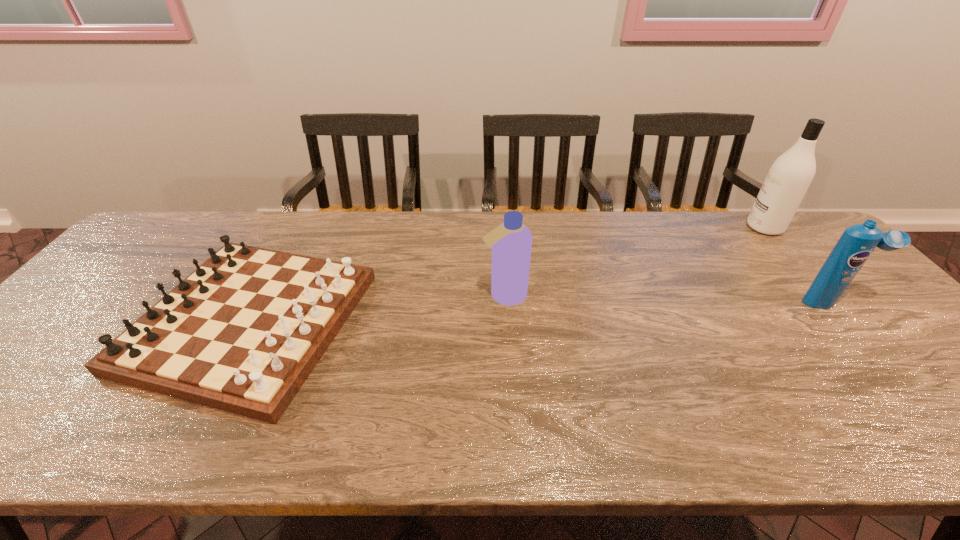
Image resolution: width=960 pixels, height=540 pixels. Find the location of `the tallest object`. the tallest object is located at coordinates (788, 179).

At what (x,y) coordinates should I click in order to perform the action: click on the tallest shampoo. Please return your answer as a coordinate pair (x, y). This screenshot has height=540, width=960. Looking at the image, I should click on (788, 179).

Where is `the second object from left to right`? The image size is (960, 540). the second object from left to right is located at coordinates (511, 241).

Locate an element on the screen. The height and width of the screenshot is (540, 960). chessboard is located at coordinates (242, 333).

The image size is (960, 540). I want to click on the leftmost object, so click(x=242, y=333).

This screenshot has width=960, height=540. Find the location of `vacant space located 0.060m on the front-facing side of the farthest object`. vacant space located 0.060m on the front-facing side of the farthest object is located at coordinates (x=729, y=227).

Where is `vacant area situated 0.190m on the front-facing side of the farthest object`? The image size is (960, 540). vacant area situated 0.190m on the front-facing side of the farthest object is located at coordinates (688, 227).

This screenshot has width=960, height=540. Find the location of `vacant space located on the front-facing side of the farthest object`. vacant space located on the front-facing side of the farthest object is located at coordinates (658, 227).

Find the location of `free space located 0.130m on the front of the leftmost shampoo`. free space located 0.130m on the front of the leftmost shampoo is located at coordinates (508, 347).

The height and width of the screenshot is (540, 960). I want to click on vacant space positioned on the right of the chessboard, so click(x=458, y=322).